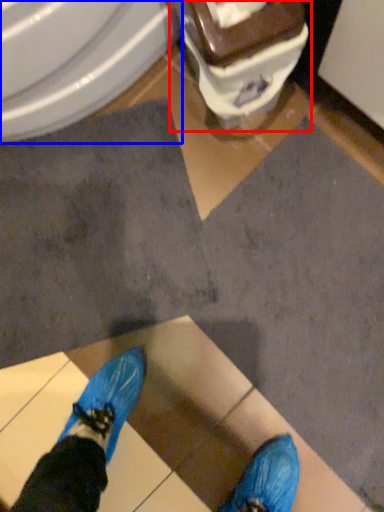
Question: Which object appears farthest to the camera in this image, toilet (highlighted by a red box) or bidet (highlighted by a blue box)?

Choices:
 (A) toilet
 (B) bidet

Answer: (B)